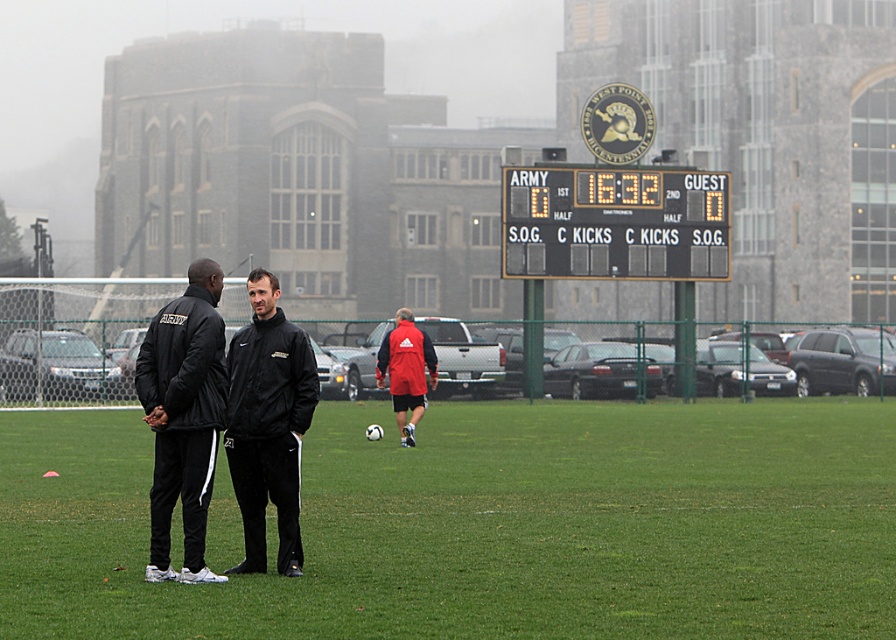
Question: Can you confirm if black plastic scoreboard at upper center is smaller than black matte jacket at left?

Choices:
 (A) yes
 (B) no

Answer: (A)

Question: Can you confirm if black plastic scoreboard at upper center is bigger than black matte jacket at left?

Choices:
 (A) yes
 (B) no

Answer: (B)

Question: Estimate the real-world distances between objects in this image. Which object is closer to the red matte jacket at center?

Choices:
 (A) black plastic scoreboard at upper center
 (B) green grass at center

Answer: (B)

Question: Does black plastic scoreboard at upper center have a lesser width compared to black matte jacket at center?

Choices:
 (A) no
 (B) yes

Answer: (A)

Question: Which of the following is the farthest from the observer?

Choices:
 (A) (247, 365)
 (B) (197, 625)
 (C) (173, 472)
 (D) (393, 352)

Answer: (D)

Question: Among these points, which one is farthest from the camera?

Choices:
 (A) (254, 582)
 (B) (432, 352)

Answer: (B)